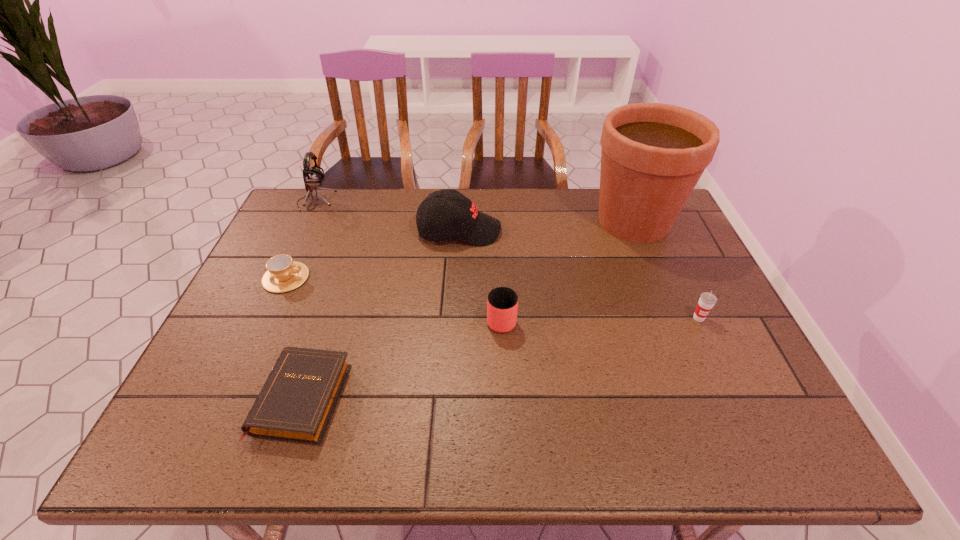
Identify the location of vacant space situated on the right of the second tallest object. (418, 200).

Where is `vacant area situated 0.090m on the front-facing side of the baseball cap`? vacant area situated 0.090m on the front-facing side of the baseball cap is located at coordinates (529, 231).

This screenshot has width=960, height=540. Find the location of `vacant space located 0.270m on the side of the rightmost cup with the logo`. vacant space located 0.270m on the side of the rightmost cup with the logo is located at coordinates (748, 422).

Where is `blank space located on the handle side of the second cup from right to left`? This screenshot has height=540, width=960. blank space located on the handle side of the second cup from right to left is located at coordinates (500, 290).

Where is `vacant point located 0.120m on the handle side of the second cup from right to left`? The width and height of the screenshot is (960, 540). vacant point located 0.120m on the handle side of the second cup from right to left is located at coordinates (x=499, y=272).

This screenshot has height=540, width=960. I want to click on free point located 0.300m on the handle side of the second cup from right to left, so click(497, 233).

This screenshot has height=540, width=960. I want to click on free space located with the handle on the side of the fourth nearest object, so click(396, 278).

Identify the location of free space located 0.230m on the back of the Bible. The height and width of the screenshot is (540, 960). (338, 288).

Locate an element on the screen. This screenshot has width=960, height=540. flowerpot located at the far edge is located at coordinates (653, 154).

This screenshot has height=540, width=960. What are the coordinates of `earphone present at the far edge` in the screenshot? It's located at (312, 176).